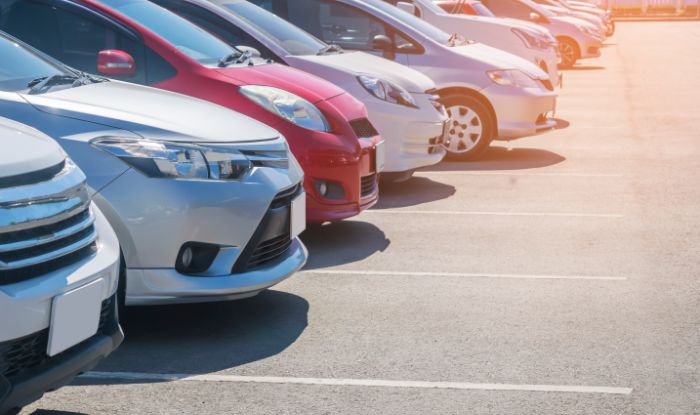
Where is `windows`? This screenshot has height=415, width=700. windows is located at coordinates (176, 34), (285, 31), (409, 20), (351, 30), (227, 34), (35, 64).